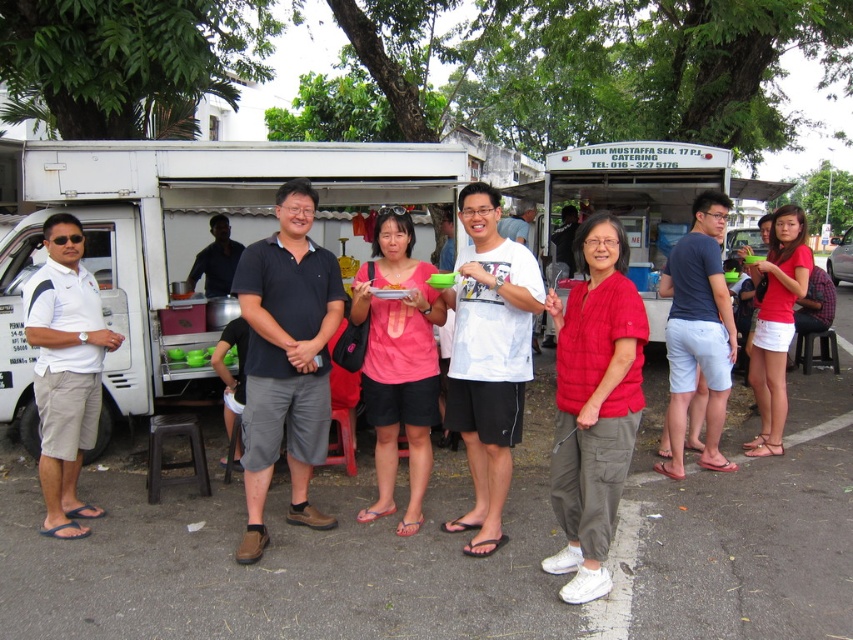
Question: Can you confirm if white cotton t-shirt at center is positioned to the right of white cotton shirt at left?

Choices:
 (A) yes
 (B) no

Answer: (A)

Question: Can you confirm if white cotton t-shirt at center is positioned to the left of red matte shorts at lower right?

Choices:
 (A) yes
 (B) no

Answer: (A)

Question: Can you confirm if dark blue cotton polo shirt at center is positioned to the left of red matte shorts at lower right?

Choices:
 (A) yes
 (B) no

Answer: (A)

Question: Among these objects, which one is nearest to the camera?

Choices:
 (A) dark blue cotton polo shirt at center
 (B) dark blue cotton t-shirt at center

Answer: (A)

Question: Which point appears farthest from the camera in this image?

Choices:
 (A) [x=601, y=253]
 (B) [x=430, y=268]
 (C) [x=64, y=513]

Answer: (C)

Question: Which object appears farthest from the camera in this image?

Choices:
 (A) red matte shorts at lower right
 (B) dark blue cotton polo shirt at center

Answer: (A)